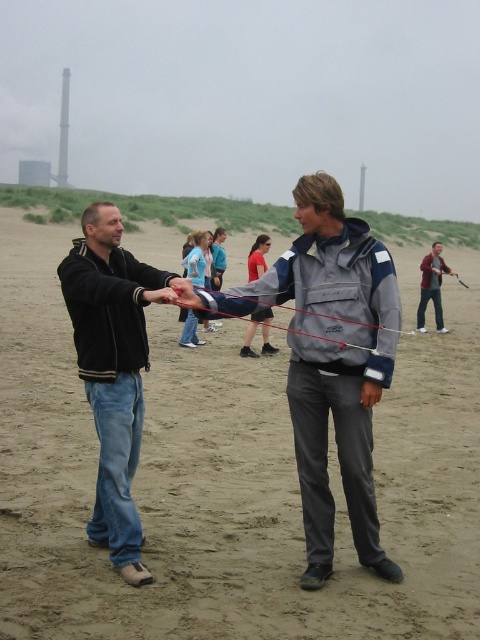
Looking at this image, is black matte jacket at left shorter than maroon fabric jacket at center?

Indeed, black matte jacket at left has a lesser height compared to maroon fabric jacket at center.

Between point (120, 397) and point (417, 321), which one is positioned behind?

Point (417, 321)

Where is `black matte jacket at left`? black matte jacket at left is located at coordinates (112, 371).

Is gray fabric jacket at center further to the viewer compared to black matte jacket at left?

No, it is in front of black matte jacket at left.

Is gray fabric jacket at center smaller than black matte jacket at left?

Yes, gray fabric jacket at center is smaller than black matte jacket at left.

Who is more distant from viewer, (385, 336) or (132, 317)?

Positioned behind is point (132, 317).

You are a GUI agent. You are given a task and a screenshot of the screen. Output one action in this format:
    pyautogui.click(x=<x>, y=<y>)
    Task: Click on the gray fabric jacket at center
    The width and height of the screenshot is (480, 640).
    Given the screenshot: What is the action you would take?
    pyautogui.click(x=331, y=362)

Based on the photo, is matte black jacket at center thinner than red string at center?

In fact, matte black jacket at center might be wider than red string at center.

Is matte black jacket at center smaller than red string at center?

No.

Is point (233, 369) more distant than point (321, 333)?

Yes, point (233, 369) is behind point (321, 333).

The height and width of the screenshot is (640, 480). I want to click on matte black jacket at center, so click(x=228, y=477).